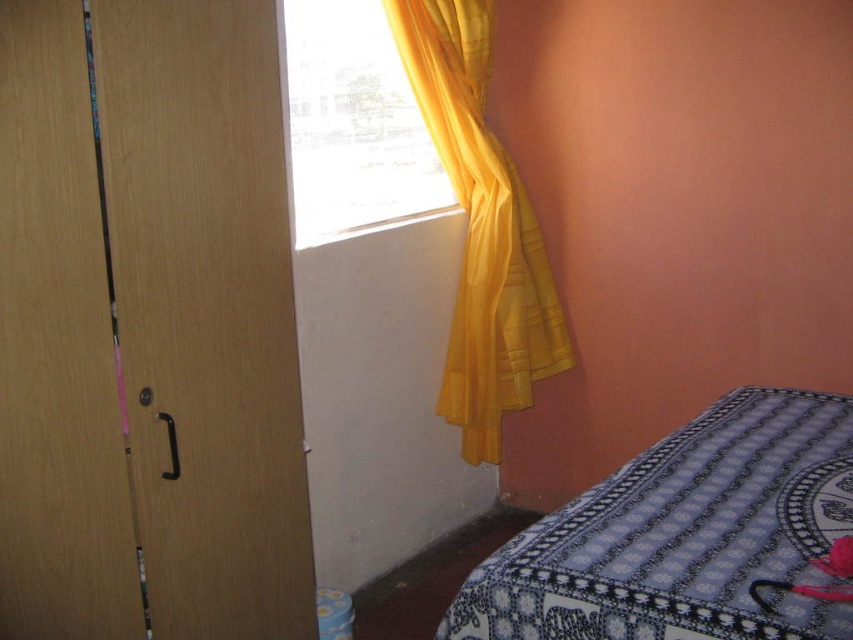
You are standing in the room and want to reach the yellow sheer curtain at upper left to adjust its position. Considering your height is 1.70 meters, can you comfortably reach it without using a stool?

The yellow sheer curtain at upper left is 2.30 meters from the camera, which is higher than your height of 1.70 meters. Therefore, you would need a stool to comfortably reach it.

You are standing in the center of the room and want to move towards the wooden closet at left without passing through the yellow sheer curtain at upper left. Which direction should you move?

You should move to the left since the wooden closet at left is located to the left of the yellow sheer curtain at upper left, meaning it is further to the left side of the room.